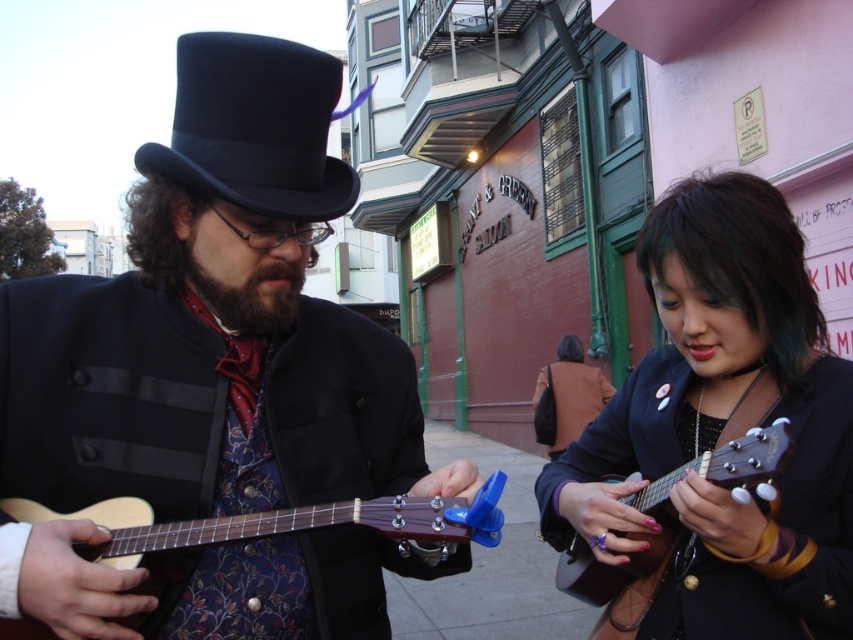
Does matte black top hat at center have a lesser height compared to wooden acoustic guitar at center?

In fact, matte black top hat at center may be taller than wooden acoustic guitar at center.

Between matte black top hat at center and wooden acoustic guitar at center, which one is positioned higher?

Positioned higher is matte black top hat at center.

Describe the element at coordinates (213, 323) in the screenshot. Image resolution: width=853 pixels, height=640 pixels. I see `matte black top hat at center` at that location.

Where is `matte black top hat at center`? The image size is (853, 640). matte black top hat at center is located at coordinates (213, 323).

Does black felt top hat at upper left have a smaller size compared to wooden acoustic guitar at center?

Yes, black felt top hat at upper left is smaller than wooden acoustic guitar at center.

Is black felt top hat at upper left to the right of wooden acoustic guitar at center from the viewer's perspective?

No, black felt top hat at upper left is not to the right of wooden acoustic guitar at center.

This screenshot has height=640, width=853. In order to click on black felt top hat at upper left in this screenshot , I will do `click(254, 125)`.

The width and height of the screenshot is (853, 640). In order to click on black felt top hat at upper left in this screenshot , I will do coord(254,125).

In the scene shown: Is wooden acoustic guitar at center shorter than brown fuzzy beard at center?

Incorrect, wooden acoustic guitar at center's height does not fall short of brown fuzzy beard at center's.

Based on the photo, does wooden acoustic guitar at center come behind brown fuzzy beard at center?

No.

Is point (158, 550) in front of point (213, 300)?

That is True.

Identify the location of wooden acoustic guitar at center. (260, 528).